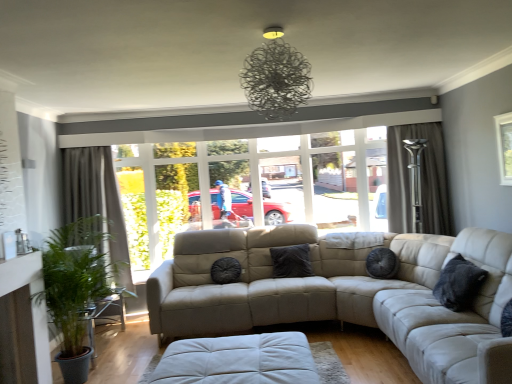
Question: Is metallic wire chandelier at upper center taller than white leather footrest at lower center?

Choices:
 (A) no
 (B) yes

Answer: (B)

Question: Does metallic wire chandelier at upper center have a lesser height compared to white leather footrest at lower center?

Choices:
 (A) no
 (B) yes

Answer: (A)

Question: Can we say metallic wire chandelier at upper center lies outside white leather footrest at lower center?

Choices:
 (A) no
 (B) yes

Answer: (B)

Question: Is metallic wire chandelier at upper center not close to white leather footrest at lower center?

Choices:
 (A) yes
 (B) no

Answer: (A)

Question: Does metallic wire chandelier at upper center appear on the right side of white leather footrest at lower center?

Choices:
 (A) no
 (B) yes

Answer: (B)

Question: From the image's perspective, is metallic wire chandelier at upper center beneath white leather footrest at lower center?

Choices:
 (A) no
 (B) yes

Answer: (A)

Question: Is dark gray textured pillow at right, which ranks as the first pillow in front-to-back order, positioned in front of velvet dark gray pillow at center, which is the first pillow from back to front?

Choices:
 (A) no
 (B) yes

Answer: (B)

Question: Can we say dark gray textured pillow at right, acting as the 3th pillow starting from the left, lies outside velvet dark gray pillow at center, positioned as the third pillow in front-to-back order?

Choices:
 (A) yes
 (B) no

Answer: (A)

Question: From the image's perspective, is dark gray textured pillow at right, which ranks as the first pillow in front-to-back order, on top of velvet dark gray pillow at center, which is the first pillow from back to front?

Choices:
 (A) no
 (B) yes

Answer: (B)

Question: Does dark gray textured pillow at right, which ranks as the first pillow in front-to-back order, come behind velvet dark gray pillow at center, which is the first pillow from back to front?

Choices:
 (A) yes
 (B) no

Answer: (B)

Question: Could velvet dark gray pillow at center, placed as the 2th pillow when sorted from right to left, be considered to be inside dark gray textured pillow at right, the 1th pillow positioned from the right?

Choices:
 (A) yes
 (B) no

Answer: (B)

Question: From a real-world perspective, is dark gray textured pillow at right, the 1th pillow positioned from the right, under velvet dark gray pillow at center, positioned as the third pillow in front-to-back order?

Choices:
 (A) yes
 (B) no

Answer: (B)

Question: Are matte beige couch at center and green leafy plant at left far apart?

Choices:
 (A) yes
 (B) no

Answer: (A)